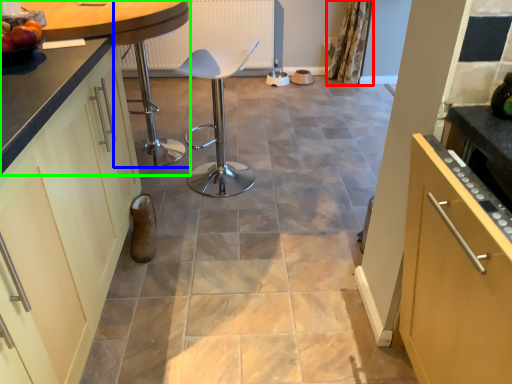
Question: Which object is positioned farthest from curtain (highlighted by a red box)? Select from bar stool (highlighted by a blue box) and countertop (highlighted by a green box).

Choices:
 (A) bar stool
 (B) countertop

Answer: (B)